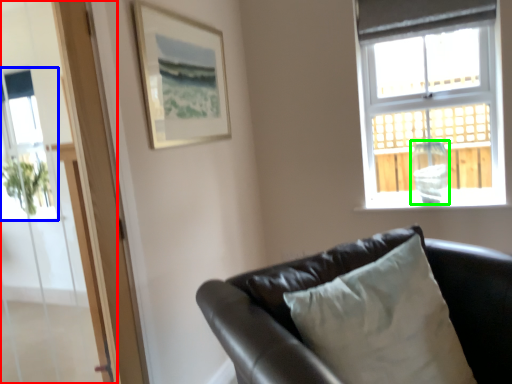
Question: Which object is the farthest from screen door (highlighted by a red box)? Choose among these: window screen (highlighted by a blue box) or glass vase (highlighted by a green box).

Choices:
 (A) window screen
 (B) glass vase

Answer: (B)